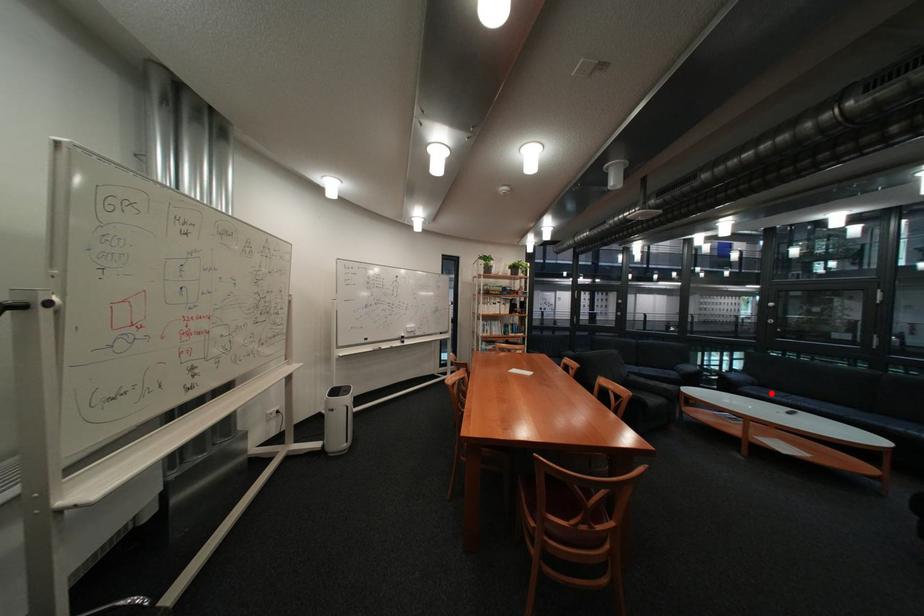
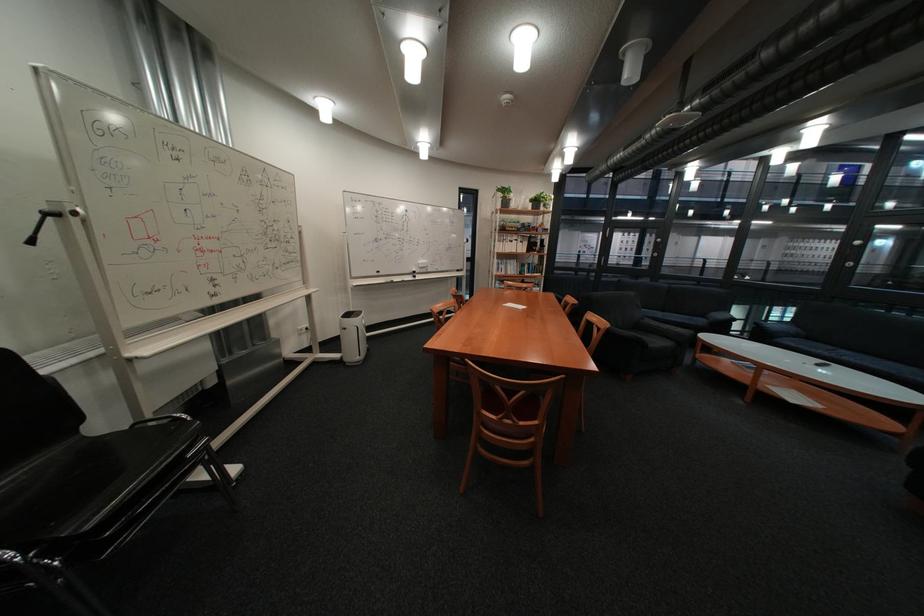
In the second image, find the point that corresponds to the highlighted location in the first image.

(808, 345)